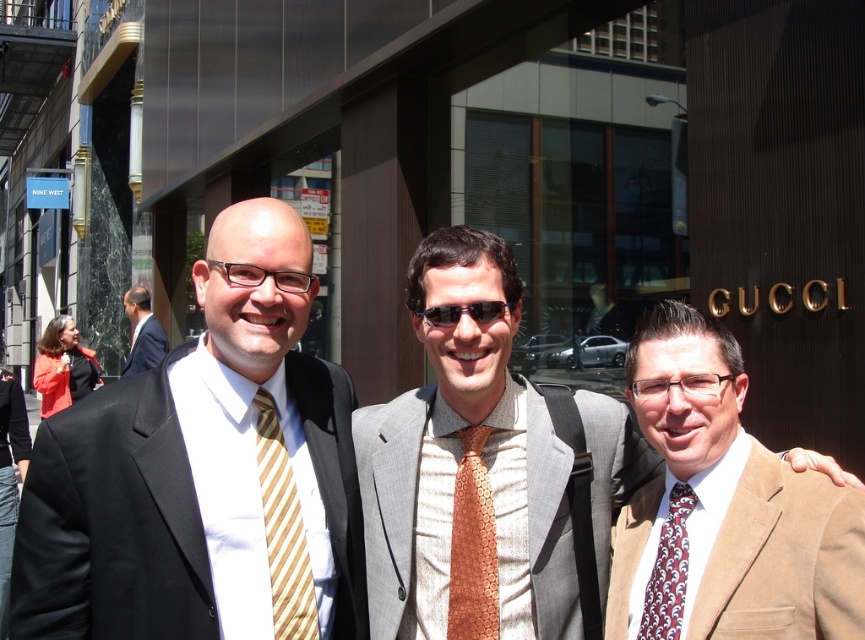
Is black suit at left to the right of dark blue suit at left from the viewer's perspective?

Correct, you'll find black suit at left to the right of dark blue suit at left.

Which is more to the left, black suit at left or dark blue suit at left?

From the viewer's perspective, dark blue suit at left appears more on the left side.

Where is `black suit at left`? This screenshot has width=865, height=640. black suit at left is located at coordinates (10, 477).

I want to click on dark red patterned tie at right, so click(668, 570).

From the picture: Between dark red patterned tie at right and dark blue suit at left, which one appears on the left side from the viewer's perspective?

dark blue suit at left

This screenshot has height=640, width=865. Describe the element at coordinates (668, 570) in the screenshot. I see `dark red patterned tie at right` at that location.

The width and height of the screenshot is (865, 640). I want to click on dark red patterned tie at right, so click(x=668, y=570).

Does matte gray suit at center appear under brown suede suit at center?

No.

Does matte gray suit at center have a greater height compared to brown suede suit at center?

Indeed, matte gray suit at center has a greater height compared to brown suede suit at center.

Measure the distance between matte gray suit at center and camera.

9.24 feet

Where is `matte gray suit at center`? matte gray suit at center is located at coordinates (484, 472).